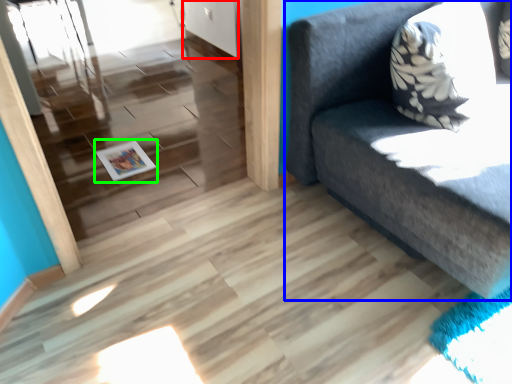
Question: Considering the real-world distances, which object is closest to door (highlighted by a red box)? studio couch (highlighted by a blue box) or magazine (highlighted by a green box).

Choices:
 (A) studio couch
 (B) magazine

Answer: (B)